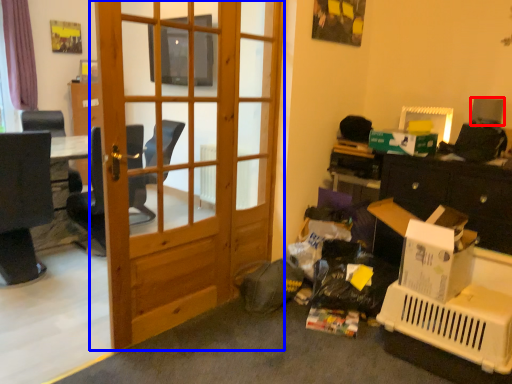
Question: Among these objects, which one is nearest to the camera, loudspeaker (highlighted by a red box) or door (highlighted by a blue box)?

Choices:
 (A) loudspeaker
 (B) door

Answer: (B)